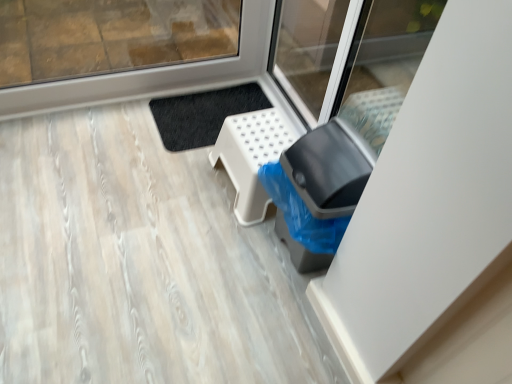
What do you see at coordinates (251, 157) in the screenshot? The image size is (512, 384). I see `white plastic stool at lower center` at bounding box center [251, 157].

The width and height of the screenshot is (512, 384). Identify the location of white plastic stool at lower center. (251, 157).

Measure the distance between white plastic stool at lower center and camera.

white plastic stool at lower center and camera are 1.56 meters apart from each other.

What do you see at coordinates (325, 172) in the screenshot? The image size is (512, 384). I see `black plastic trash can at lower right` at bounding box center [325, 172].

Identify the location of black plastic trash can at lower right. (325, 172).

Identify the location of white plastic stool at lower center. The image size is (512, 384). (251, 157).

In the image, is white plastic stool at lower center on the left side or the right side of black plastic trash can at lower right?

From the image, it's evident that white plastic stool at lower center is to the left of black plastic trash can at lower right.

Does white plastic stool at lower center lie in front of black plastic trash can at lower right?

No, white plastic stool at lower center is further to the viewer.

Considering the positions of point (293, 141) and point (321, 241), is point (293, 141) closer or farther from the camera than point (321, 241)?

Point (293, 141) is positioned farther from the camera compared to point (321, 241).

From the image's perspective, is white plastic stool at lower center located above or below black plastic trash can at lower right?

From the image's perspective, white plastic stool at lower center appears above black plastic trash can at lower right.

From a real-world perspective, is white plastic stool at lower center located higher than black plastic trash can at lower right?

No, from a real-world perspective, white plastic stool at lower center is not above black plastic trash can at lower right.

Which of these two, white plastic stool at lower center or black plastic trash can at lower right, is thinner?

black plastic trash can at lower right.

Does white plastic stool at lower center have a greater height compared to black plastic trash can at lower right?

In fact, white plastic stool at lower center may be shorter than black plastic trash can at lower right.

Who is smaller, white plastic stool at lower center or black plastic trash can at lower right?

white plastic stool at lower center is smaller.

Would you say white plastic stool at lower center is outside black plastic trash can at lower right?

Yes, white plastic stool at lower center is outside of black plastic trash can at lower right.

Are white plastic stool at lower center and black plastic trash can at lower right making contact?

No, white plastic stool at lower center is not beside black plastic trash can at lower right.

Is white plastic stool at lower center facing towards black plastic trash can at lower right?

No, white plastic stool at lower center is not aimed at black plastic trash can at lower right.

What's the angular difference between white plastic stool at lower center and black plastic trash can at lower right's facing directions?

There is a 0.00086-degree angle between the facing directions of white plastic stool at lower center and black plastic trash can at lower right.

The width and height of the screenshot is (512, 384). In order to click on furniture that appears above the black plastic trash can at lower right (from the image's perspective) in this screenshot , I will do `click(251, 157)`.

Between black plastic trash can at lower right and white plastic stool at lower center, which one appears on the left side from the viewer's perspective?

white plastic stool at lower center is more to the left.

Is black plastic trash can at lower right further to camera compared to white plastic stool at lower center?

No, the depth of black plastic trash can at lower right is less than that of white plastic stool at lower center.

Is point (360, 174) positioned before point (244, 148)?

That is True.

From the image's perspective, does black plastic trash can at lower right appear higher than white plastic stool at lower center?

No, from the image's perspective, black plastic trash can at lower right is not over white plastic stool at lower center.

From a real-world perspective, is black plastic trash can at lower right physically located above or below white plastic stool at lower center?

black plastic trash can at lower right is above white plastic stool at lower center.

Consider the image. Can you confirm if black plastic trash can at lower right is wider than white plastic stool at lower center?

Incorrect, the width of black plastic trash can at lower right does not surpass that of white plastic stool at lower center.

Does black plastic trash can at lower right have a lesser height compared to white plastic stool at lower center?

In fact, black plastic trash can at lower right may be taller than white plastic stool at lower center.

Can you confirm if black plastic trash can at lower right is smaller than white plastic stool at lower center?

Actually, black plastic trash can at lower right might be larger than white plastic stool at lower center.

Is black plastic trash can at lower right situated inside white plastic stool at lower center or outside?

black plastic trash can at lower right is located beyond the bounds of white plastic stool at lower center.

Are black plastic trash can at lower right and white plastic stool at lower center making contact?

No, black plastic trash can at lower right is not next to white plastic stool at lower center.

Could you tell me if black plastic trash can at lower right is facing white plastic stool at lower center?

No.

Find the location of a particular element. furniture on the left of black plastic trash can at lower right is located at coordinates pos(251,157).

This screenshot has width=512, height=384. In order to click on furniture directly beneath the black plastic trash can at lower right (from a real-world perspective) in this screenshot , I will do `click(251, 157)`.

In the image, there is a black plastic trash can at lower right. Identify the location of furniture above it (from the image's perspective). (251, 157).